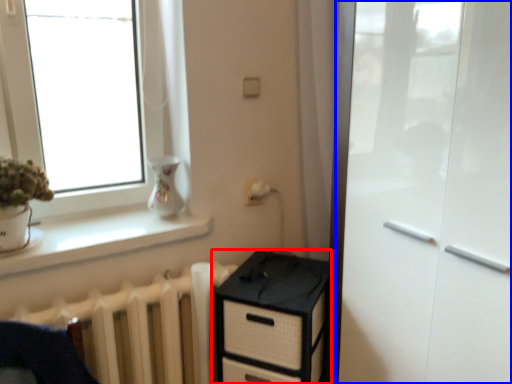
Question: Among these objects, which one is nearest to the camera, chest of drawers (highlighted by a red box) or screen door (highlighted by a blue box)?

Choices:
 (A) chest of drawers
 (B) screen door

Answer: (B)